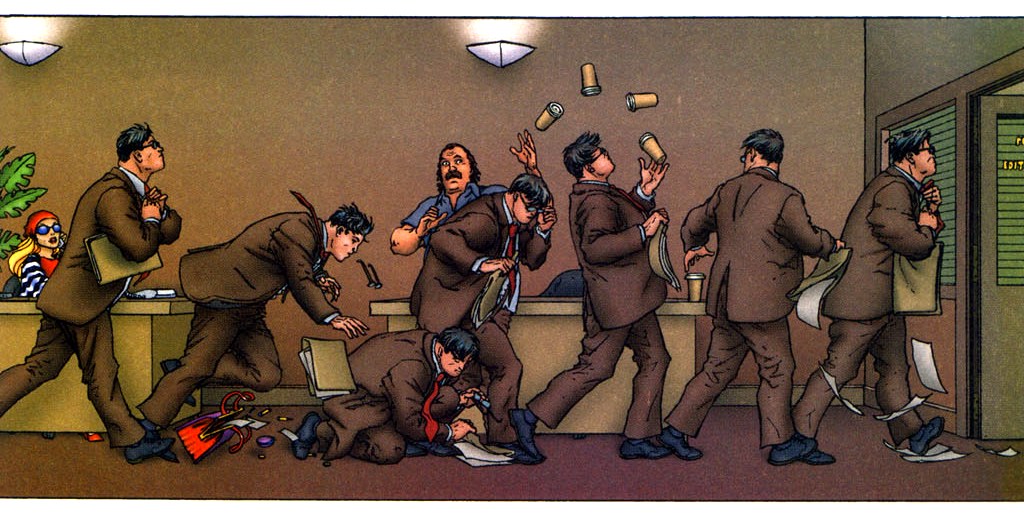
At what (x,y) coordinates should I click in order to perform the action: click on wall light fixture. Please return your answer as a coordinate pair (x, y). The height and width of the screenshot is (513, 1024). Looking at the image, I should click on (512, 52), (32, 46).